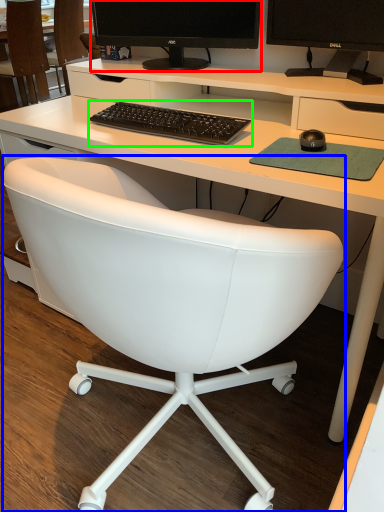
Question: Based on their relative distances, which object is farther from computer monitor (highlighted by a red box)? Choose from chair (highlighted by a blue box) and computer keyboard (highlighted by a green box).

Choices:
 (A) chair
 (B) computer keyboard

Answer: (A)